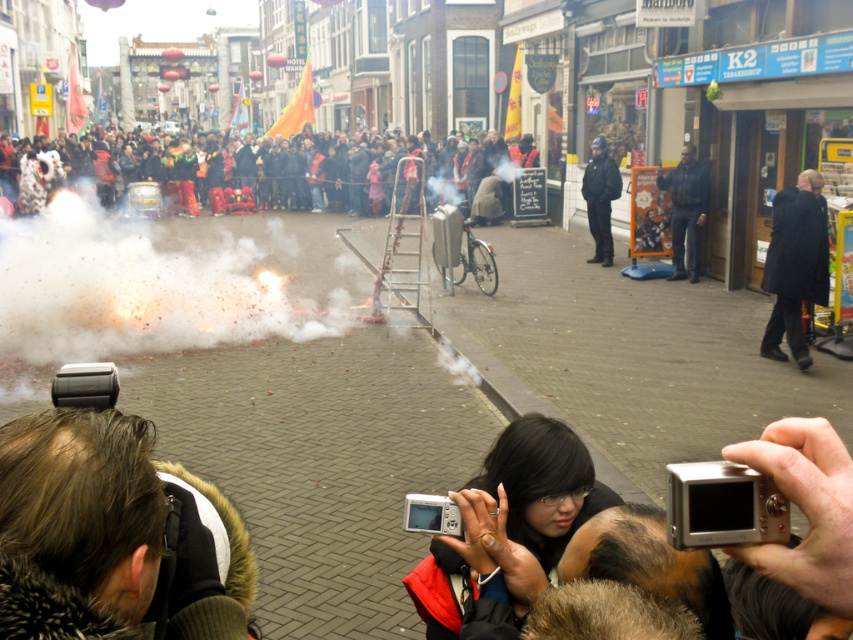
You are a photographer trying to capture the fireworks display. You notice two people in the crowd wearing a dark wool coat at right and a dark blue jacket at center. Which person should you focus on to get a better shot of the fireworks above the ladder?

The dark blue jacket at center is taller than the dark wool coat at right, so focusing on the person wearing the dark blue jacket at center would provide a better vantage point for capturing the fireworks above the ladder.

You are a photographer trying to capture the fireworks display. You notice the dark blue jacket at center and the dark clothing crowd at center in your frame. Which object should you focus on to ensure it takes up more space in your photo?

The dark clothing crowd at center should be focused on because it is larger than the dark blue jacket at center, ensuring it occupies more space in the photo.

You are a street performer standing at the corner of the street. You need to quickly reach the black uniformed officer at center to ask for permission to perform. What is the shortest path you can take to reach the officer?

The shortest path would be to move directly towards the black uniformed officer at center located at point (601, 198), avoiding any obstacles like the crowd or fireworks.